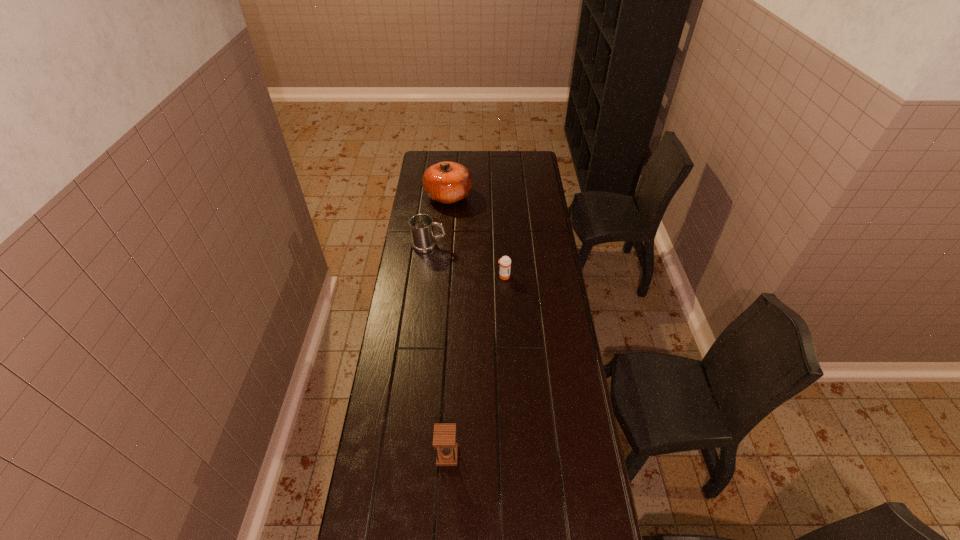
Identify which object is the closest to the hourglass. Please provide its 2D coordinates. Your answer should be formatted as a tuple, i.e. [(x, y)], where the tuple contains the x and y coordinates of a point satisfying the conditions above.

[(505, 262)]

Locate an element on the screen. The width and height of the screenshot is (960, 540). object that is the second nearest to the nearest object is located at coordinates (423, 239).

Locate an element on the screen. vacant position in the image that satisfies the following two spatial constraints: 1. on the back side of the nearest object; 2. on the left side of the rightmost object is located at coordinates (456, 276).

Identify the location of vacant space that satisfies the following two spatial constraints: 1. on the side of the nearest object with the handle; 2. on the left side of the second farthest object. (404, 455).

In order to click on free spot that satisfies the following two spatial constraints: 1. on the front side of the farthest object; 2. on the side of the third nearest object with the handle in this screenshot , I will do `click(444, 246)`.

Locate an element on the screen. This screenshot has height=540, width=960. vacant space that satisfies the following two spatial constraints: 1. on the front side of the pumpkin; 2. on the right side of the hourglass is located at coordinates (425, 455).

The image size is (960, 540). Find the location of `free spot that satisfies the following two spatial constraints: 1. on the front side of the tallest object; 2. on the right side of the shortest object`. free spot that satisfies the following two spatial constraints: 1. on the front side of the tallest object; 2. on the right side of the shortest object is located at coordinates (441, 276).